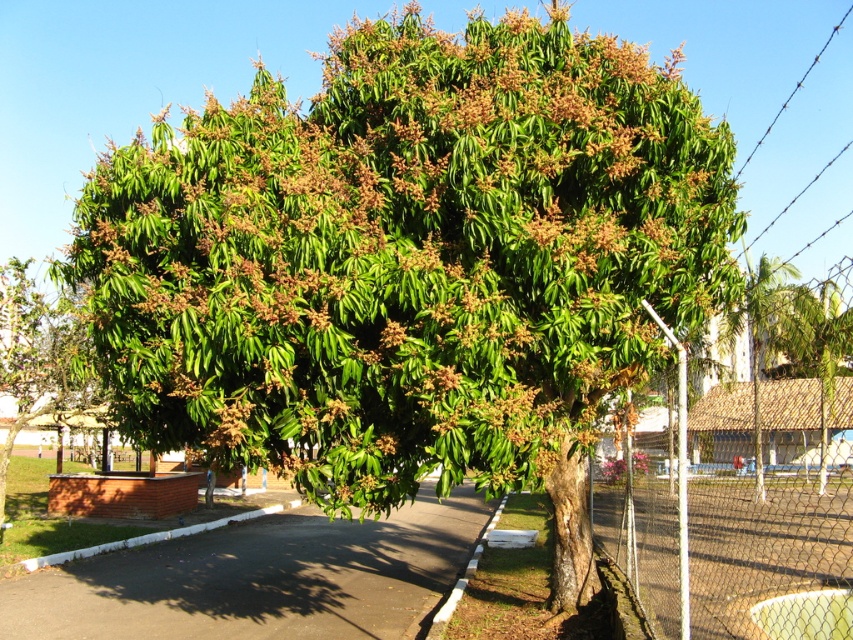
Between wire mesh fence at right and green glossy tree at lower left, which one is positioned lower?

wire mesh fence at right is below.

Which is more to the right, wire mesh fence at right or green glossy tree at lower left?

wire mesh fence at right

Is point (701, 502) positioned after point (54, 378)?

No, it is not.

Where is `wire mesh fence at right`? The height and width of the screenshot is (640, 853). wire mesh fence at right is located at coordinates (730, 538).

Between point (155, 634) and point (482, 544), which one is positioned in front?

Point (155, 634) is more forward.

Image resolution: width=853 pixels, height=640 pixels. In order to click on dark gray asphalt at center in this screenshot , I will do `click(260, 579)`.

Is green glossy tree at lower left in front of pink matte flower at center?

Yes, green glossy tree at lower left is closer to the viewer.

Based on the photo, does green glossy tree at lower left have a greater width compared to pink matte flower at center?

Yes.

Is point (45, 298) farther from camera compared to point (640, 461)?

Yes.

Find the location of a particular element. This screenshot has height=640, width=853. green glossy tree at lower left is located at coordinates (39, 358).